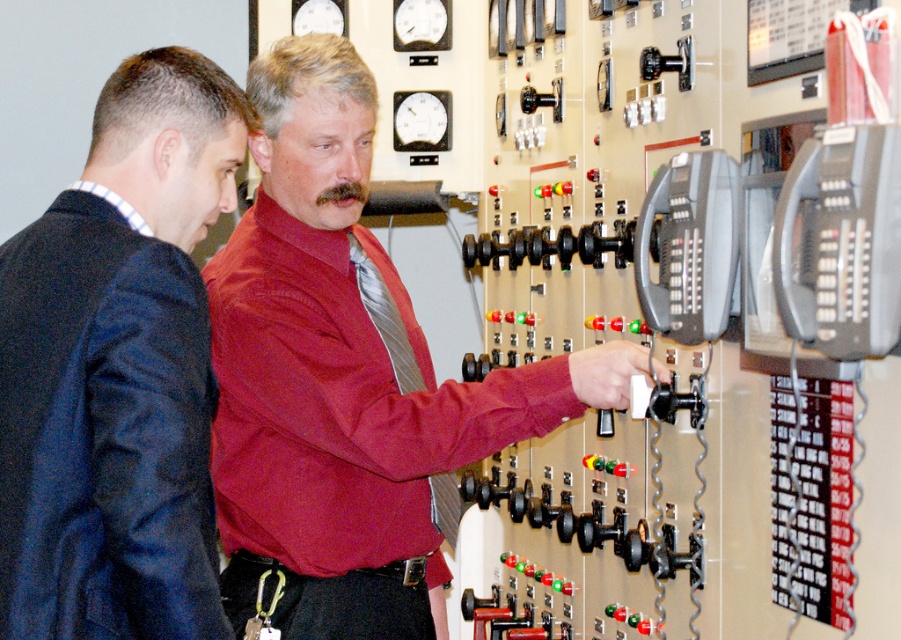
You are standing in the control room and need to locate the matte red shirt at center. According to the coordinates provided, where should you look?

The matte red shirt at center is located at the 2D coordinates point (346, 376).

You are an observer in the control room. You notice the matte red shirt at center and the silky silver tie at center. Which object is closer to you?

The matte red shirt at center is closer to you because it is in front of the silky silver tie at center.

You are a maintenance worker needing to reach both the dark blue suit at left and the silky silver tie at center. Given your arm can extend 24 inches, can you comfortably reach both objects without moving your body?

The distance between dark blue suit at left and silky silver tie at center is 24.31 inches. Since your arm can only extend 24 inches, you cannot comfortably reach both objects without moving your body.